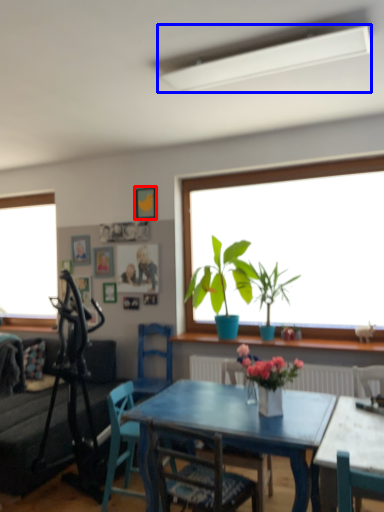
Question: Which object appears closest to the camera in this image, picture frame (highlighted by a red box) or lamp (highlighted by a blue box)?

Choices:
 (A) picture frame
 (B) lamp

Answer: (B)